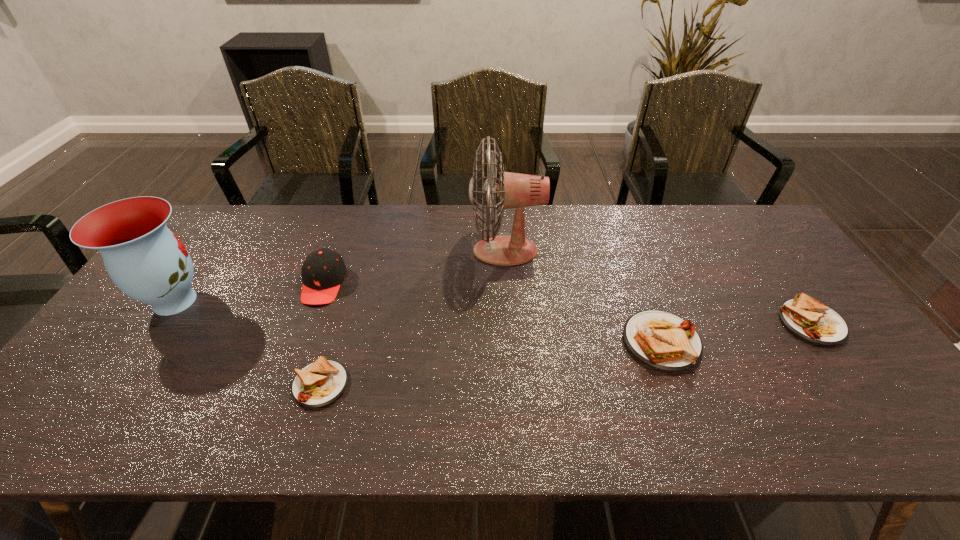
Locate an element on the screen. This screenshot has height=540, width=960. cap is located at coordinates (323, 270).

Image resolution: width=960 pixels, height=540 pixels. I want to click on vacant space located on the left of the shortest object, so click(x=145, y=384).

This screenshot has height=540, width=960. Identify the location of vacant space located on the left of the second sandwich from left to right. click(475, 342).

Identify the location of vacant area located on the back of the second shortest sandwich. (773, 271).

Where is `free space located 0.060m on the back of the fifth shortest object`? The image size is (960, 540). free space located 0.060m on the back of the fifth shortest object is located at coordinates (202, 262).

Find the location of `vacant area situated 0.340m in front of the tallest object to direct airflow`. vacant area situated 0.340m in front of the tallest object to direct airflow is located at coordinates (363, 251).

Where is `vacant space located in front of the tallest object to direct airflow`? The image size is (960, 540). vacant space located in front of the tallest object to direct airflow is located at coordinates (423, 251).

What are the coordinates of `free location located 0.200m in front of the tallest object to direct airflow` in the screenshot? It's located at (407, 251).

You are a GUI agent. You are given a task and a screenshot of the screen. Output one action in this format:
    pyautogui.click(x=<x>, y=<y>)
    Task: Click on the free space located on the front-facing side of the fourth shortest object
    
    Given the screenshot: What is the action you would take?
    pyautogui.click(x=293, y=367)

This screenshot has height=540, width=960. In order to click on object at the far edge in this screenshot , I will do `click(513, 190)`.